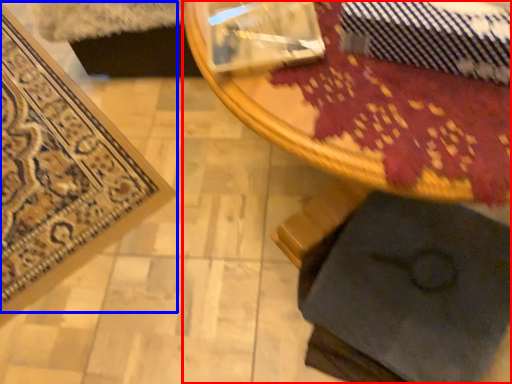
Question: Among these objects, which one is farthest to the camera, table (highlighted by a red box) or mat (highlighted by a blue box)?

Choices:
 (A) table
 (B) mat

Answer: (B)